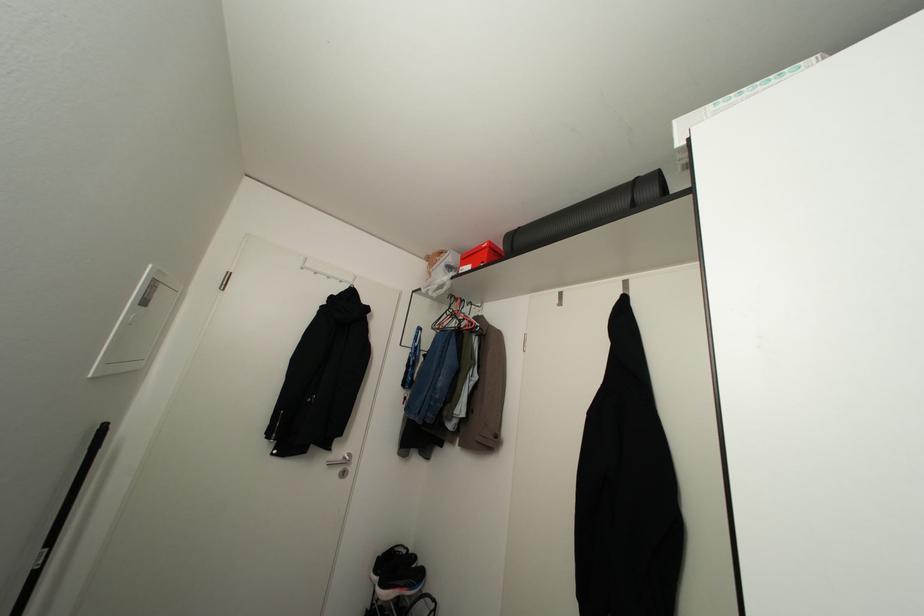
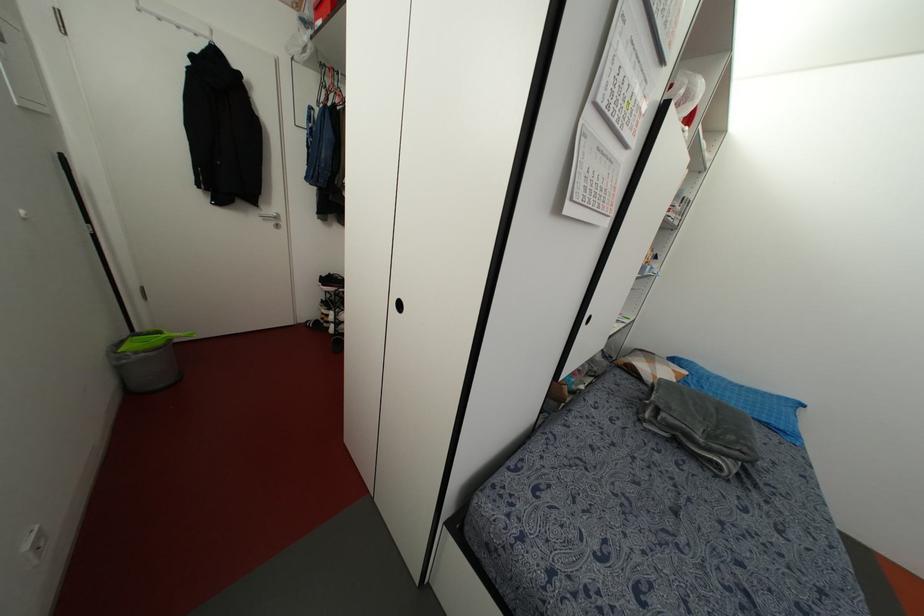
In the second image, find the point that corresponds to [50,541] in the first image.

(88, 221)